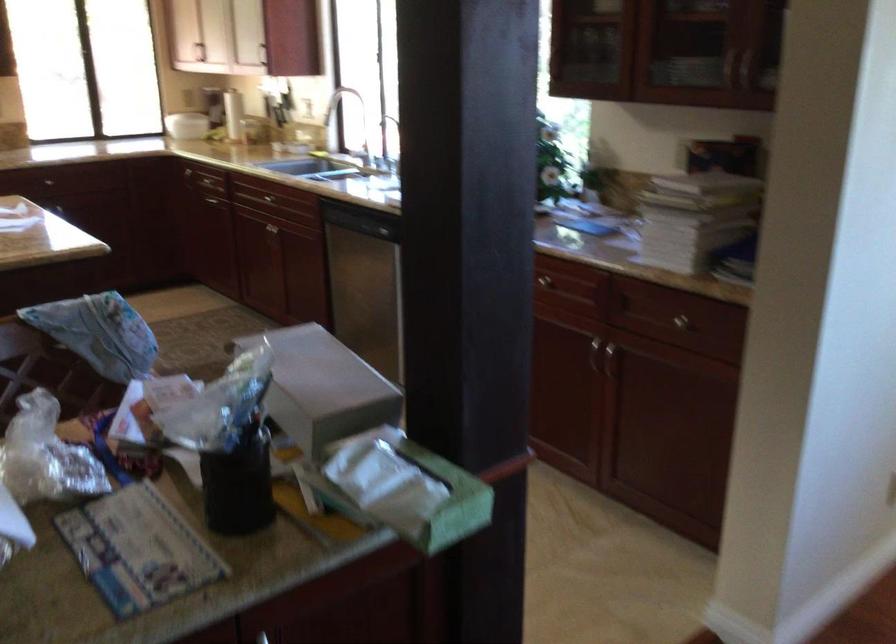
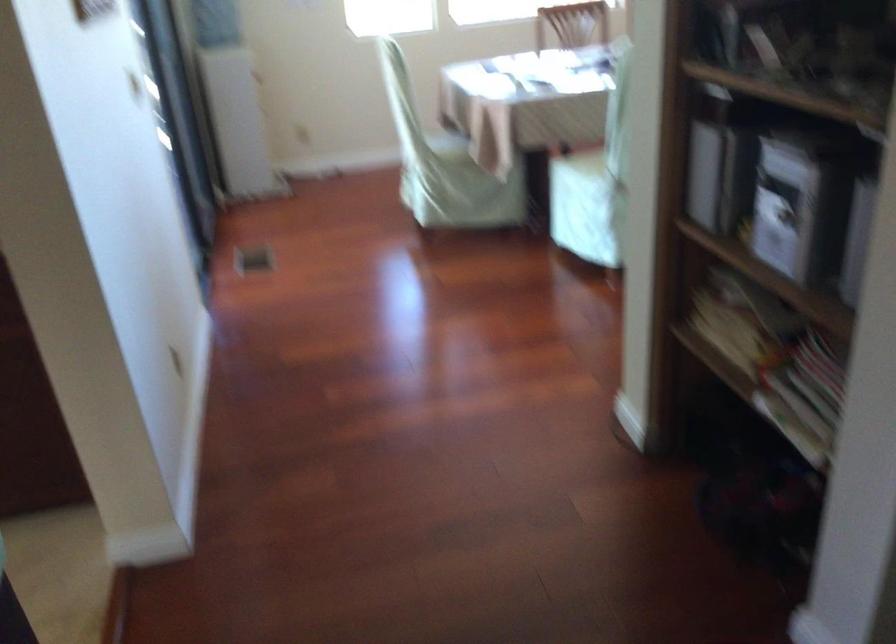
The first image is from the beginning of the video and the second image is from the end. How did the camera likely rotate when shooting the video?

The camera's rotation is toward right-down.